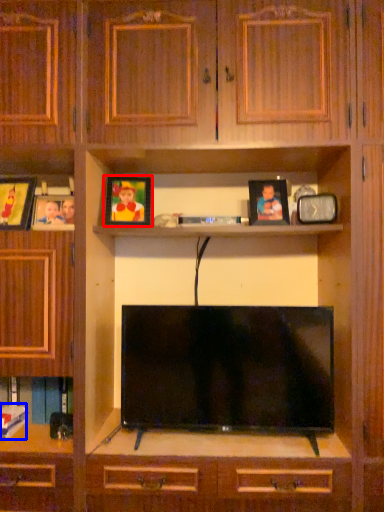
Question: Which object is further to the camera taking this photo, picture frame (highlighted by a red box) or book (highlighted by a blue box)?

Choices:
 (A) picture frame
 (B) book

Answer: (A)